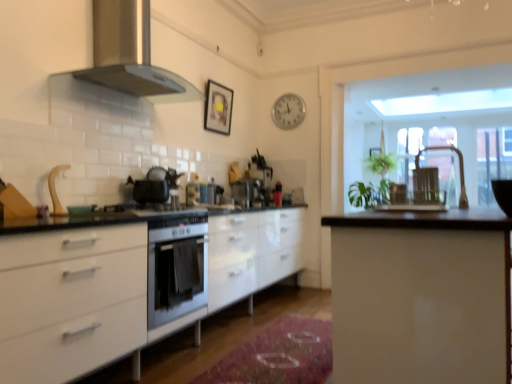
You are a GUI agent. You are given a task and a screenshot of the screen. Output one action in this format:
    pyautogui.click(x=<x>, y=<y>)
    Task: Click on the matte black picture frame at upper center, the 1th picture frame when ordered from left to right
    The width and height of the screenshot is (512, 384).
    Given the screenshot: What is the action you would take?
    pyautogui.click(x=218, y=108)

Locate an element on the screen. This screenshot has height=384, width=512. matte black gas stove at center is located at coordinates (153, 209).

Where is `matte black kettle at center, placed as the 1th appliance when sorted from left to right`? The width and height of the screenshot is (512, 384). matte black kettle at center, placed as the 1th appliance when sorted from left to right is located at coordinates (149, 190).

What are the coordinates of `metallic silver sink at right, acting as the second sink starting from the back` in the screenshot? It's located at (414, 199).

Where is `rug at center`? rug at center is located at coordinates (x=278, y=355).

What is the approximate height of clear glass door at upper right?

1.38 meters.

Where is `matte black picture frame at upper center, which is the first picture frame in front-to-back order`? This screenshot has height=384, width=512. matte black picture frame at upper center, which is the first picture frame in front-to-back order is located at coordinates (218, 108).

Is white glossy cabinets at center, arranged as the 2th cabinetry when viewed from the right, touching satin black coffee machine at center, positioned as the second coffee machine in front-to-back order?

No, white glossy cabinets at center, arranged as the 2th cabinetry when viewed from the right, is not making contact with satin black coffee machine at center, positioned as the second coffee machine in front-to-back order.

Consider the image. From the image's perspective, which one is positioned higher, white glossy cabinets at center, arranged as the 2th cabinetry when viewed from the right, or satin black coffee machine at center, positioned as the second coffee machine in front-to-back order?

satin black coffee machine at center, positioned as the second coffee machine in front-to-back order, appears higher in the image.

At what (x,y) coordinates should I click in order to perform the action: click on the 2nd coffee machine counting from the right side of the white glossy cabinets at center, which appears as the 1th cabinetry when viewed from the left. Please return your answer as a coordinate pair (x, y). Image resolution: width=512 pixels, height=384 pixels. Looking at the image, I should click on (261, 163).

Can you confirm if matte black picture frame at upper center, the 2th picture frame viewed from the back, is shorter than satin silver range hood at upper left?

Indeed, matte black picture frame at upper center, the 2th picture frame viewed from the back, has a lesser height compared to satin silver range hood at upper left.

Looking at their sizes, would you say matte black picture frame at upper center, the 2th picture frame viewed from the back, is wider or thinner than satin silver range hood at upper left?

matte black picture frame at upper center, the 2th picture frame viewed from the back, is thinner than satin silver range hood at upper left.

From the image's perspective, between matte black picture frame at upper center, the 2th picture frame viewed from the back, and satin silver range hood at upper left, who is located below?

matte black picture frame at upper center, the 2th picture frame viewed from the back, is shown below in the image.

Does matte black picture frame at upper center, the 1th picture frame when ordered from left to right, come in front of satin silver range hood at upper left?

No.

You are a GUI agent. You are given a task and a screenshot of the screen. Output one action in this format:
    pyautogui.click(x=<x>, y=<y>)
    Task: Click on the chair above the matte black gas stove at center (from a real-world perspective)
    Image resolution: width=512 pixels, height=384 pixels.
    Given the screenshot: What is the action you would take?
    pyautogui.click(x=398, y=193)

From the picture: Is matte black gas stove at center further to the viewer compared to metallic silver chair at right?

Yes, matte black gas stove at center is behind metallic silver chair at right.

From a real-world perspective, is matte black gas stove at center located beneath metallic silver chair at right?

Yes.

Considering the relative positions of matte black gas stove at center and metallic silver chair at right in the image provided, is matte black gas stove at center to the left of metallic silver chair at right from the viewer's perspective?

Correct, you'll find matte black gas stove at center to the left of metallic silver chair at right.

Is white glossy cabinet at right, the second cabinetry viewed from the left, bigger than satin black coffee machine at center, which is the 1th coffee machine from back to front?

Indeed, white glossy cabinet at right, the second cabinetry viewed from the left, has a larger size compared to satin black coffee machine at center, which is the 1th coffee machine from back to front.

Looking at their sizes, would you say white glossy cabinet at right, the second cabinetry viewed from the left, is wider or thinner than satin black coffee machine at center, which is the 1th coffee machine from back to front?

In the image, white glossy cabinet at right, the second cabinetry viewed from the left, appears to be wider than satin black coffee machine at center, which is the 1th coffee machine from back to front.

How many degrees apart are the facing directions of white glossy cabinet at right, the second cabinetry viewed from the left, and satin black coffee machine at center, positioned as the second coffee machine in front-to-back order?

white glossy cabinet at right, the second cabinetry viewed from the left, and satin black coffee machine at center, positioned as the second coffee machine in front-to-back order, are facing 1.11 degrees away from each other.

From the image's perspective, is white glossy cabinet at right, which appears as the 1th cabinetry when viewed from the right, positioned above or below satin black coffee machine at center, which is the 1th coffee machine from back to front?

Based on their image positions, white glossy cabinet at right, which appears as the 1th cabinetry when viewed from the right, is located beneath satin black coffee machine at center, which is the 1th coffee machine from back to front.

Is matte black kettle at center, acting as the second appliance starting from the front, oriented away from metallic silver chair at right?

No, matte black kettle at center, acting as the second appliance starting from the front, is not facing away from metallic silver chair at right.

Which is closer to the camera, (162, 186) or (398, 185)?

Clearly, point (162, 186) is more distant from the camera than point (398, 185).

Can you confirm if matte black kettle at center, placed as the 1th appliance when sorted from left to right, is smaller than metallic silver chair at right?

Incorrect, matte black kettle at center, placed as the 1th appliance when sorted from left to right, is not smaller in size than metallic silver chair at right.

From a real-world perspective, which is physically below, matte black kettle at center, acting as the second appliance starting from the front, or metallic silver chair at right?

In real-world perspective, metallic silver chair at right is lower.

Is clear glass door at upper right with matte black picture frame at upper center, the 2th picture frame viewed from the back?

No.

Between clear glass door at upper right and matte black picture frame at upper center, the 2th picture frame viewed from the back, which one is positioned behind?

clear glass door at upper right.

At what (x,y) coordinates should I click in order to perform the action: click on glass door located underneath the matte black picture frame at upper center, the 1th picture frame when ordered from left to right (from a real-world perspective). Please return your answer as a coordinate pair (x, y). Image resolution: width=512 pixels, height=384 pixels. Looking at the image, I should click on (445, 172).

In terms of height, does white glossy cabinets at center, which appears as the 1th cabinetry when viewed from the left, look taller or shorter compared to clear glass faucet at right?

white glossy cabinets at center, which appears as the 1th cabinetry when viewed from the left, is taller than clear glass faucet at right.

From the picture: From the image's perspective, which is below, white glossy cabinets at center, which appears as the 1th cabinetry when viewed from the left, or clear glass faucet at right?

white glossy cabinets at center, which appears as the 1th cabinetry when viewed from the left.

Is white glossy cabinets at center, which appears as the 1th cabinetry when viewed from the left, in front of or behind clear glass faucet at right in the image?

white glossy cabinets at center, which appears as the 1th cabinetry when viewed from the left, is in front of clear glass faucet at right.

Is point (139, 243) closer to camera compared to point (452, 146)?

Yes, it is.

At what (x,y) coordinates should I click in order to perform the action: click on cabinetry that appears on the left of satin black coffee machine at center, which is the 1th coffee machine from back to front. Please return your answer as a coordinate pair (x, y). This screenshot has width=512, height=384. Looking at the image, I should click on (129, 285).

Find the location of a particular element. home appliance above the matte black picture frame at upper center, the 2th picture frame viewed from the back (from the image's perspective) is located at coordinates (130, 54).

Looking at the image, which one is located closer to white glossy sink at center, arranged as the second sink when viewed from the front, rug at center or white glossy cabinet at right, the second cabinetry viewed from the left?

rug at center.

When comparing their distances from matte black kettle at center, the 2th appliance when ordered from right to left, does clear glass faucet at right or satin silver coffee machine at center, the first coffee machine from the front, seem further?

clear glass faucet at right lies further to matte black kettle at center, the 2th appliance when ordered from right to left, than the other object.

Consider the image. Considering their positions, is matte black kettle at right, placed as the 2th appliance when sorted from left to right, positioned closer to metallic silver sink at right, acting as the second sink starting from the back, than white glossy cabinet at right, which appears as the 1th cabinetry when viewed from the right?

matte black kettle at right, placed as the 2th appliance when sorted from left to right, is closer to metallic silver sink at right, acting as the second sink starting from the back.

From the image, which object appears to be nearer to metallic silver chair at right, matte black picture frame at upper center, which is the first picture frame in front-to-back order, or matte black gas stove at center?

matte black gas stove at center lies closer to metallic silver chair at right than the other object.

Looking at the image, which one is located further to white glossy cabinets at center, which appears as the 1th cabinetry when viewed from the left, matte black picture frame at upper center, which is the first picture frame in front-to-back order, or metallic silver sink at right, acting as the second sink starting from the back?

Based on the image, matte black picture frame at upper center, which is the first picture frame in front-to-back order, appears to be further to white glossy cabinets at center, which appears as the 1th cabinetry when viewed from the left.

Considering their positions, is satin silver range hood at upper left positioned closer to rug at center than white glossy sink at center, arranged as the second sink when viewed from the front?

Among the two, white glossy sink at center, arranged as the second sink when viewed from the front, is located nearer to rug at center.

Looking at the image, which one is located closer to satin silver range hood at upper left, matte black kettle at center, acting as the second appliance starting from the front, or satin silver coffee machine at center, which is the 2th coffee machine from back to front?

Based on the image, matte black kettle at center, acting as the second appliance starting from the front, appears to be nearer to satin silver range hood at upper left.

When comparing their distances from rug at center, does satin black coffee machine at center, positioned as the second coffee machine in front-to-back order, or wooden picture frame at upper center, the first picture frame viewed from the back, seem closer?

satin black coffee machine at center, positioned as the second coffee machine in front-to-back order, lies closer to rug at center than the other object.

Locate an element on the screen. Image resolution: width=512 pixels, height=384 pixels. chair positioned between white glossy cabinet at right, which appears as the 1th cabinetry when viewed from the right, and wooden picture frame at upper center, the first picture frame viewed from the back, from near to far is located at coordinates (398, 193).

Where is `chair positioned between matte black kettle at right, which is counted as the 1th appliance, starting from the front, and white glossy sink at center, arranged as the second sink when viewed from the front, from near to far`? chair positioned between matte black kettle at right, which is counted as the 1th appliance, starting from the front, and white glossy sink at center, arranged as the second sink when viewed from the front, from near to far is located at coordinates (398, 193).

I want to click on plain located between white glossy cabinets at center, which appears as the 1th cabinetry when viewed from the left, and satin black coffee machine at center, positioned as the second coffee machine in front-to-back order, in the depth direction, so click(278, 355).

Locate an element on the screen. picture frame located between satin silver range hood at upper left and clear glass faucet at right in the left-right direction is located at coordinates coord(218,108).